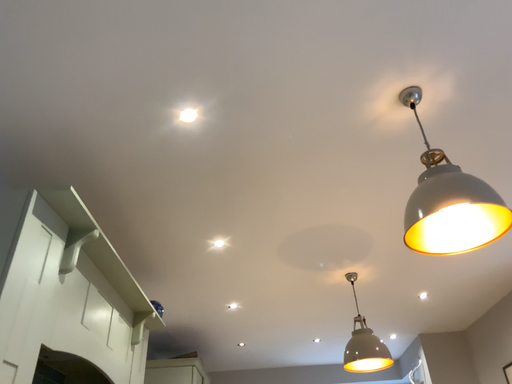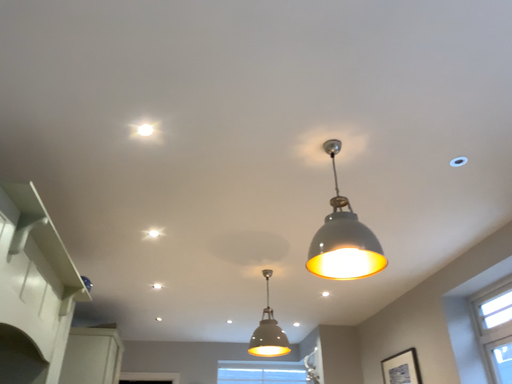
Question: Which way did the camera rotate in the video?

Choices:
 (A) rotated left
 (B) rotated right

Answer: (B)